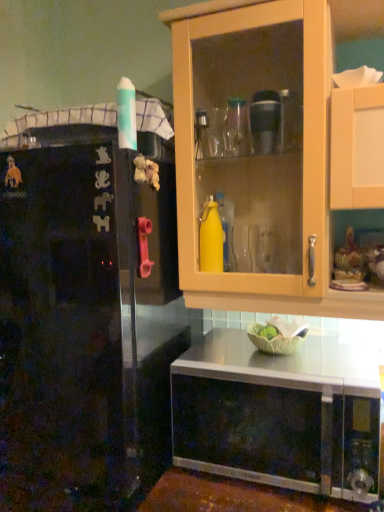
Question: From the image's perspective, relative to stainless steel microwave at lower center, is black matte refrigerator at left above or below?

Choices:
 (A) below
 (B) above

Answer: (A)

Question: Considering their positions, is black matte refrigerator at left located in front of or behind stainless steel microwave at lower center?

Choices:
 (A) front
 (B) behind

Answer: (A)

Question: In the image, is black matte refrigerator at left on the left side or the right side of stainless steel microwave at lower center?

Choices:
 (A) left
 (B) right

Answer: (A)

Question: Is stainless steel microwave at lower center in front of or behind black matte refrigerator at left in the image?

Choices:
 (A) front
 (B) behind

Answer: (B)

Question: Based on their positions, is stainless steel microwave at lower center located to the left or right of black matte refrigerator at left?

Choices:
 (A) left
 (B) right

Answer: (B)

Question: From a real-world perspective, is stainless steel microwave at lower center physically located above or below black matte refrigerator at left?

Choices:
 (A) above
 (B) below

Answer: (A)

Question: From the image's perspective, relative to black matte refrigerator at left, is stainless steel microwave at lower center above or below?

Choices:
 (A) below
 (B) above

Answer: (B)